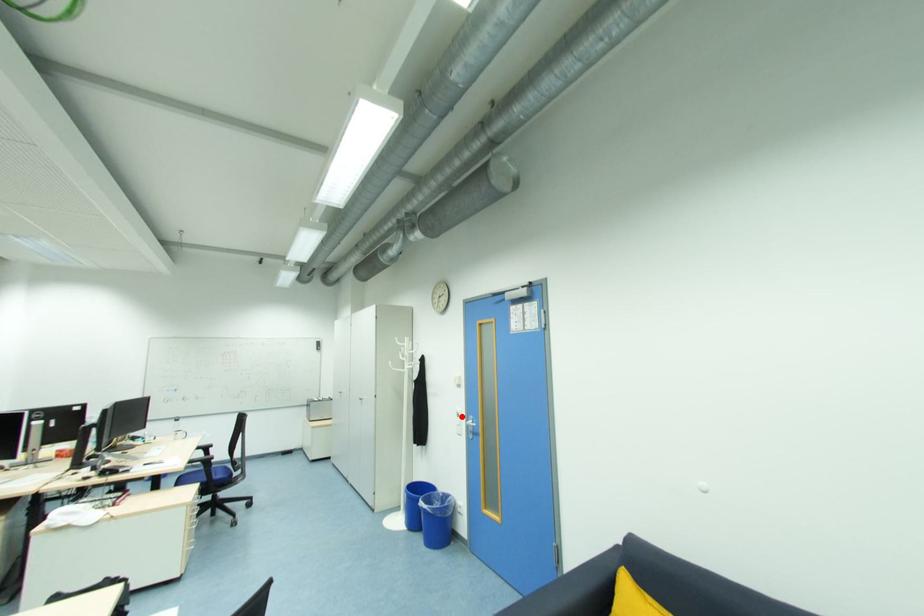
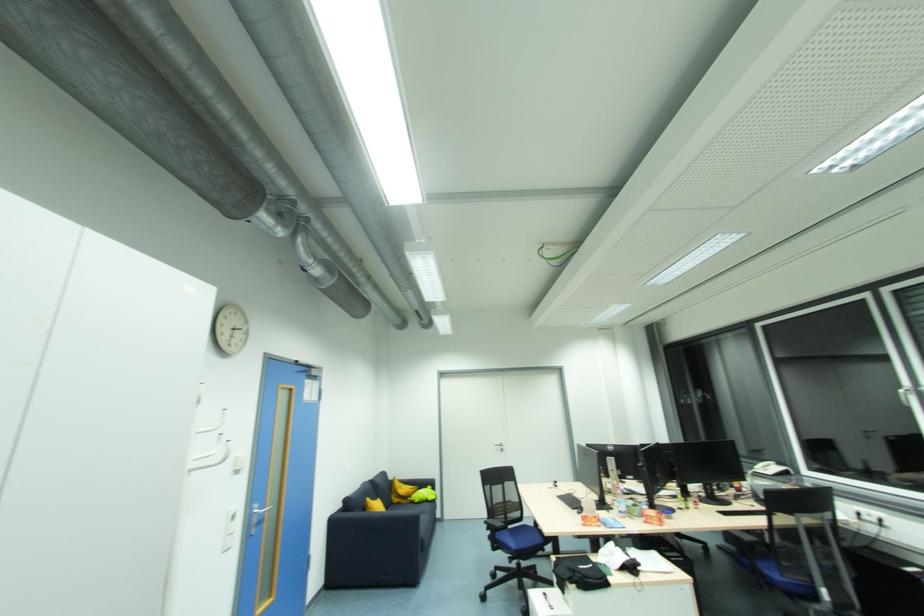
Question: I am providing you with two images of the same scene from different viewpoints. Given a red point in image1, look at the same physical point in image2. Is it:

Choices:
 (A) Closer to the viewpoint
 (B) Farther from the viewpoint

Answer: (A)